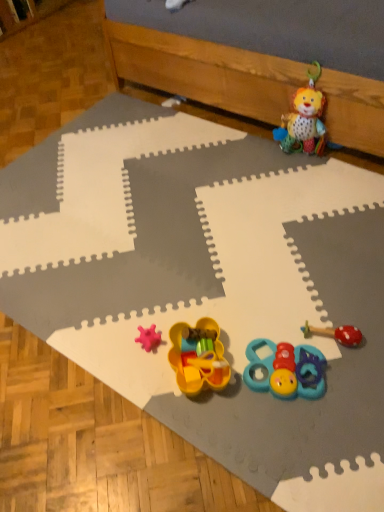
Question: Based on their sizes in the image, would you say teal rubber teething toy at lower center, placed as the 1th toy when sorted from bottom to top, is bigger or smaller than wooden at upper right?

Choices:
 (A) big
 (B) small

Answer: (B)

Question: In terms of height, does teal rubber teething toy at lower center, the 3th toy when ordered from back to front, look taller or shorter compared to wooden at upper right?

Choices:
 (A) tall
 (B) short

Answer: (B)

Question: Which is nearer to the teal rubber teething toy at lower center, the 3th toy when ordered from back to front?

Choices:
 (A) wooden at upper right
 (B) plush fabric lion at upper right, the 1th toy viewed from the top
 (C) yellow plastic toy at center, which appears as the 3th toy when viewed from the top
 (D) red rubber teething ring at lower right, positioned as the third toy in bottom-to-top order

Answer: (D)

Question: Estimate the real-world distances between objects in this image. Which object is closer to the yellow plastic toy at center, acting as the 1th toy starting from the front?

Choices:
 (A) plush fabric lion at upper right, the 1th toy viewed from the top
 (B) red rubber teething ring at lower right, the 2th toy in the top-to-bottom sequence
 (C) teal rubber teething toy at lower center, the 3th toy when ordered from back to front
 (D) wooden at upper right

Answer: (C)